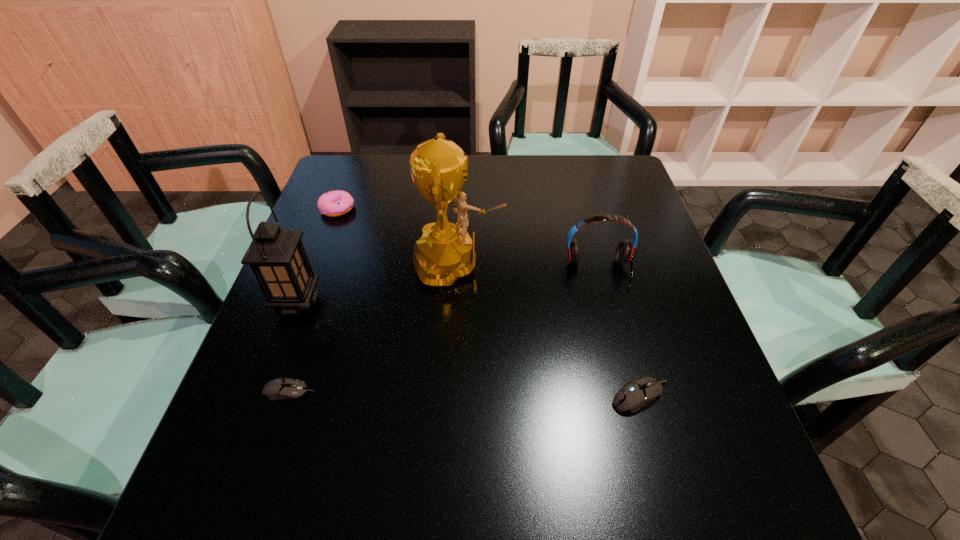
Locate an element on the screen. free space at the near right corner of the desktop is located at coordinates (677, 415).

Identify the location of vacant area that lies between the fourth shortest object and the shorter computer mouse. The width and height of the screenshot is (960, 540). (444, 332).

The height and width of the screenshot is (540, 960). I want to click on vacant space in between the second shortest object and the headset, so pyautogui.click(x=619, y=334).

In order to click on vacant area that lies between the third object from right to left and the third shortest object in this screenshot , I will do `click(397, 236)`.

Locate an element on the screen. vacant region between the lantern and the second shortest object is located at coordinates pyautogui.click(x=468, y=349).

Where is `vacant area that lies between the third object from right to left and the second shortest object`? The width and height of the screenshot is (960, 540). vacant area that lies between the third object from right to left and the second shortest object is located at coordinates (549, 330).

At what (x,y) coordinates should I click in order to perform the action: click on free spot between the left computer mouse and the second shortest object. Please return your answer as a coordinate pair (x, y). The image size is (960, 540). Looking at the image, I should click on (465, 394).

Find the location of a particular element. This screenshot has width=960, height=540. vacant area between the headset and the award is located at coordinates (528, 268).

In order to click on vacant space in between the taller computer mouse and the fourth object from left to right in this screenshot , I will do `click(549, 330)`.

At what (x,y) coordinates should I click in order to perform the action: click on empty space that is in between the taller computer mouse and the award. Please return your answer as a coordinate pair (x, y). This screenshot has height=540, width=960. Looking at the image, I should click on (549, 330).